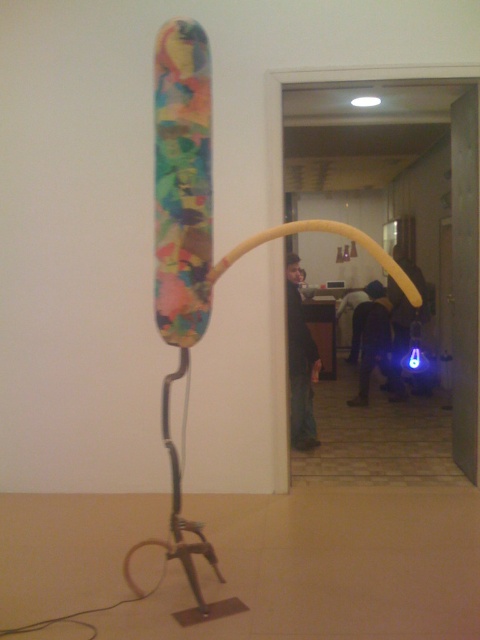
You are an observer looking at the scene. You notice two items at the center of the image labeled as dark blue jeans at center and dark fabric jacket at center. Which one is positioned higher up?

The dark blue jeans at center is located above dark fabric jacket at center, so the dark blue jeans at center is positioned higher up.

You are standing in the room with the artwork. There is a point at coordinates (x=300, y=362). What object is located at that point?

The point at coordinates (x=300, y=362) indicates dark blue jeans at center.

You are an interior designer planning to place a new sofa in the room. The sofa will be positioned where the dark blue jeans at center currently are. Based on the scene, will the blue led light at center interfere with the sofa placement in terms of space?

The dark blue jeans at center occupies less space than blue led light at center, so placing the sofa where the dark blue jeans at center is may leave less space for the blue led light at center, potentially causing interference.